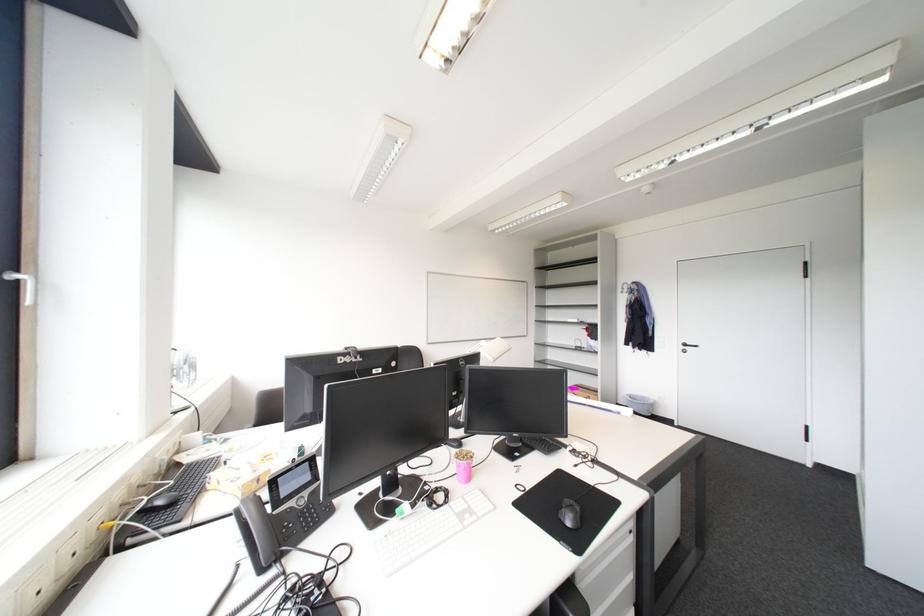
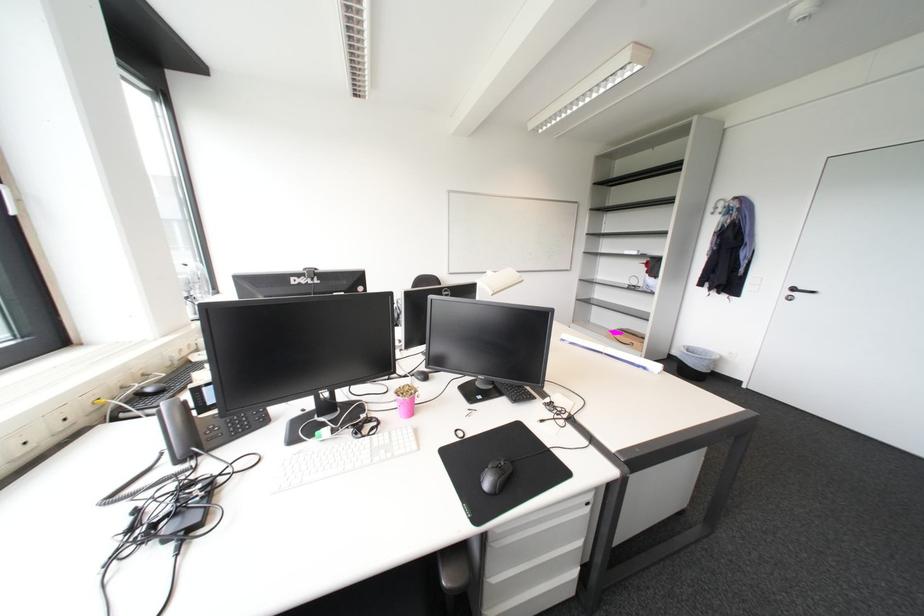
The point at (530, 445) is marked in the first image. Where is the corresponding point in the second image?

(502, 387)